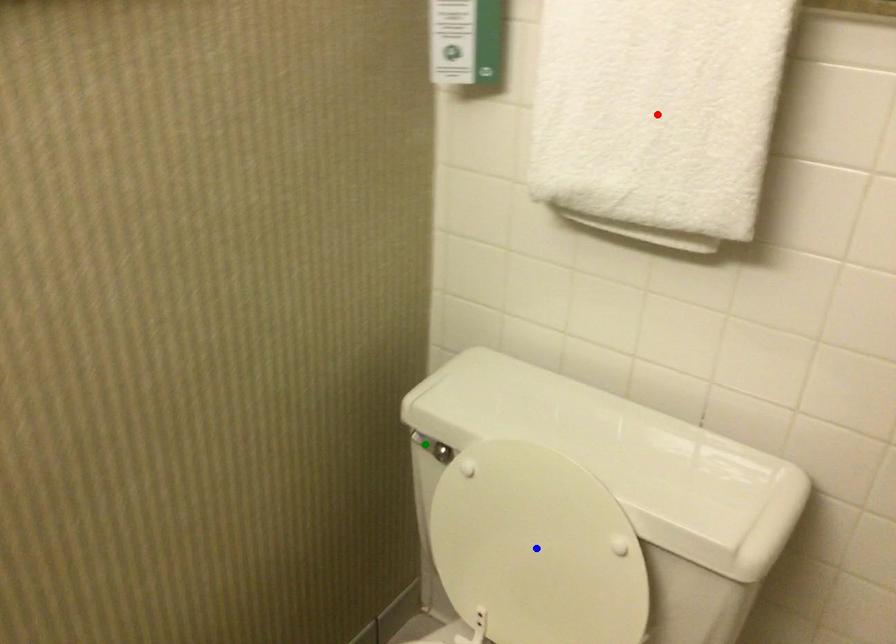
Order these from nearest to farthest:
1. red point
2. green point
3. blue point

red point < blue point < green point